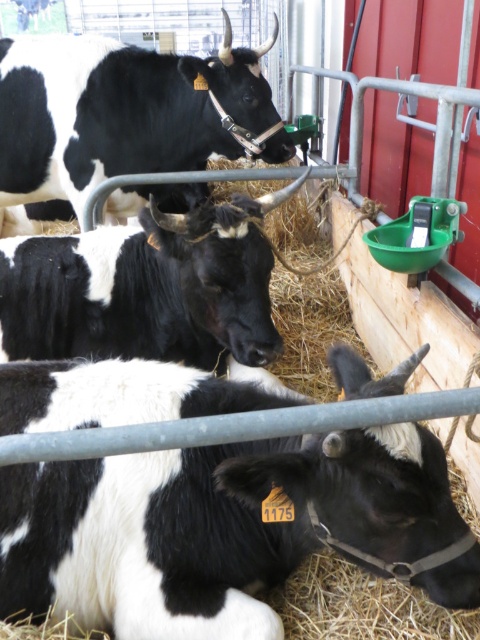
Is black and white fur at lower left wider than black matte cow at upper left?

No, black and white fur at lower left is not wider than black matte cow at upper left.

Is point (45, 472) positioned before point (41, 83)?

Yes, point (45, 472) is closer to viewer.

Locate an element on the screen. This screenshot has width=480, height=640. black and white fur at lower left is located at coordinates (x=226, y=529).

Based on the photo, is black matte cow at upper left to the left of black matte cow at center from the viewer's perspective?

Yes, black matte cow at upper left is to the left of black matte cow at center.

Is black matte cow at upper left thinner than black matte cow at center?

Incorrect, black matte cow at upper left's width is not less than black matte cow at center's.

Who is more distant from viewer, (76, 177) or (132, 289)?

Point (76, 177)

At what (x,y) coordinates should I click in order to perform the action: click on black matte cow at upper left. Please return your answer as a coordinate pair (x, y). The height and width of the screenshot is (640, 480). Looking at the image, I should click on (121, 116).

Is black and white fur at lower left to the left of black matte cow at center from the viewer's perspective?

Incorrect, black and white fur at lower left is not on the left side of black matte cow at center.

Consider the image. Does black and white fur at lower left appear over black matte cow at center?

No, black and white fur at lower left is not above black matte cow at center.

Identify the location of black and white fur at lower left. The height and width of the screenshot is (640, 480). (226, 529).

Image resolution: width=480 pixels, height=640 pixels. Identify the location of black and white fur at lower left. (226, 529).